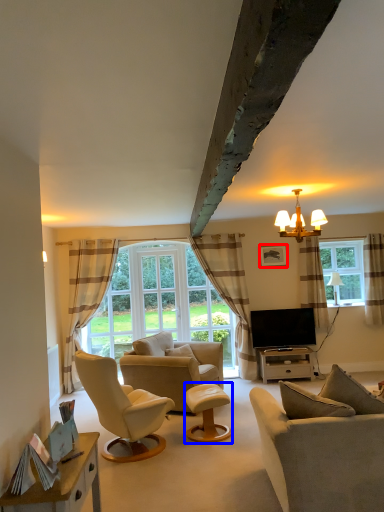
Question: Which object appears farthest to the camera in this image, picture frame (highlighted by a red box) or stool (highlighted by a blue box)?

Choices:
 (A) picture frame
 (B) stool

Answer: (A)